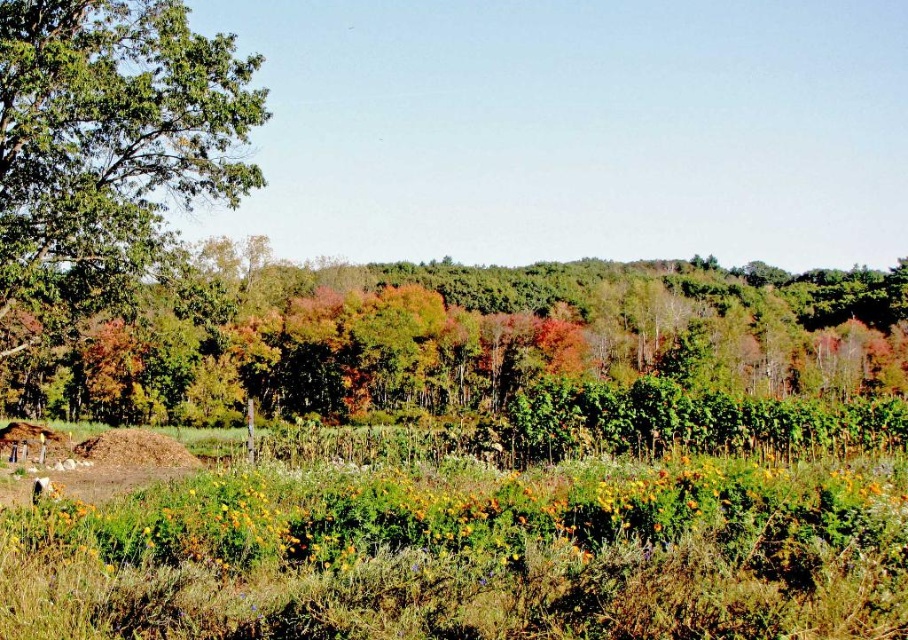
In the scene shown: You are a landscape architect designing a garden pathway between the green leafy tree at center and the green leafy tree at upper left. Which tree requires more space on the pathway due to its width?

The green leafy tree at center requires more space on the pathway because its width is larger than the green leafy tree at upper left.

You are standing in the autumn landscape and want to take a photo of both the green grass at lower center and the green leafy tree at upper left. Based on their positions, which one will appear closer to the camera in your photo?

The green grass at lower center will appear closer to the camera in the photo because it is positioned in front of the green leafy tree at upper left.

You are standing at the origin point in the image and want to walk towards the point at coordinates point [244,385]. However, there is an obstacle at point [227,122]. Will you collide with the obstacle before reaching your destination?

Point [244,385] is behind point [227,122], so you will collide with the obstacle at point [227,122] before reaching your destination.